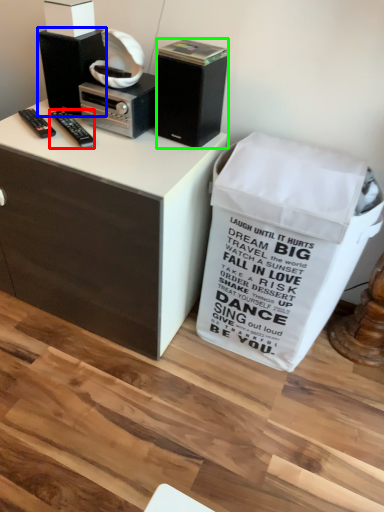
Question: Which object is positioned closest to remote control (highlighted by a red box)? Select from loudspeaker (highlighted by a blue box) and loudspeaker (highlighted by a green box).

Choices:
 (A) loudspeaker
 (B) loudspeaker

Answer: (A)